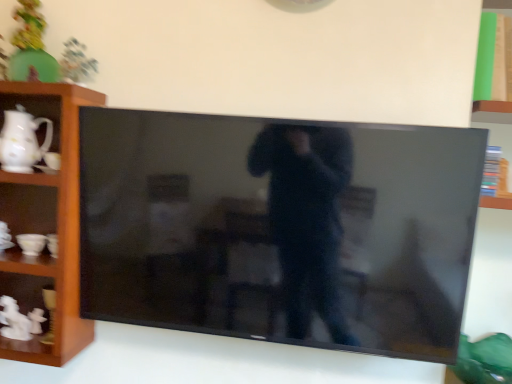
Question: Choose the correct answer: Is wooden shelf at left inside black glossy tv at center or outside it?

Choices:
 (A) inside
 (B) outside

Answer: (B)

Question: Based on their sizes in the image, would you say wooden shelf at left is bigger or smaller than black glossy tv at center?

Choices:
 (A) small
 (B) big

Answer: (A)

Question: Considering the real-world distances, which object is closest to the matte green toy at upper left?

Choices:
 (A) black glossy tv at center
 (B) wooden shelf at left
 (C) white glossy pitcher at left

Answer: (C)

Question: Which object is positioned closest to the wooden shelf at left?

Choices:
 (A) matte green toy at upper left
 (B) white glossy pitcher at left
 (C) black glossy tv at center

Answer: (B)